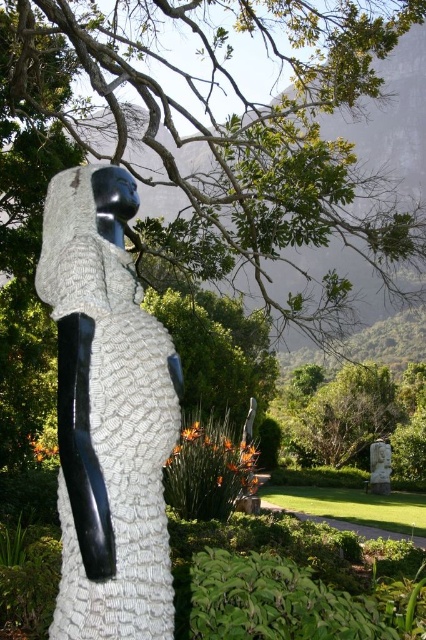
You are an artist planning to place a new sculpture in the garden. You have two statues available. The first is the textured white statue at center, and the second is the white marble statue at lower right. Which statue has a narrower width?

The textured white statue at center is thinner than the white marble statue at lower right, so the textured white statue at center has a narrower width.

You are standing at the entrance of the garden and want to locate the textured white statue at center. According to the coordinates provided, where should you look relative to your current position?

The textured white statue at center is located at coordinates point (109,413), which means it is positioned to the right and slightly below your current viewpoint.

You are standing in the garden and want to take a photo of both the green leafy tree at upper center and the white marble statue at lower right. Which object should you focus on first to ensure both are in clear view?

You should focus on the green leafy tree at upper center first because it is closer to the viewer than the white marble statue at lower right, so adjusting focus from near to far will help both be in clear view.